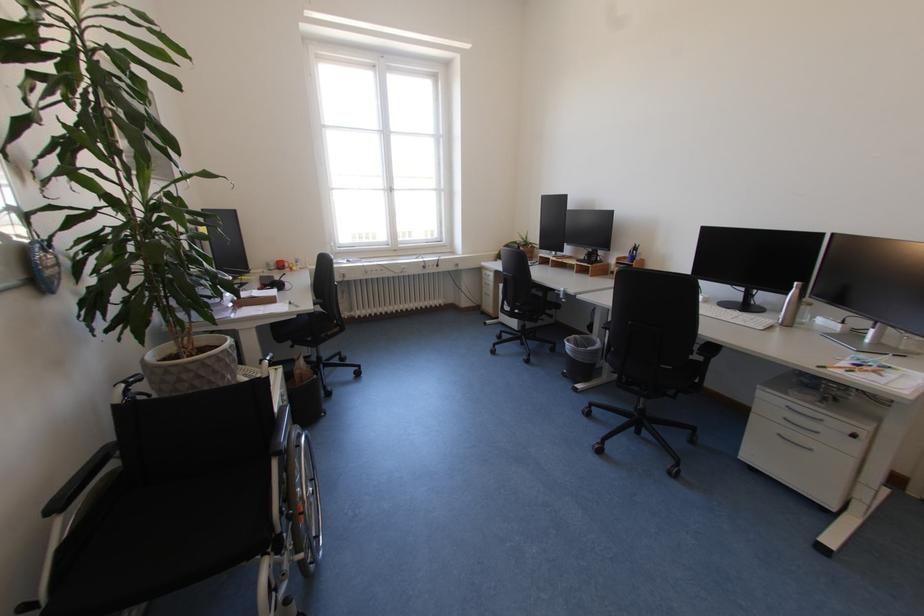
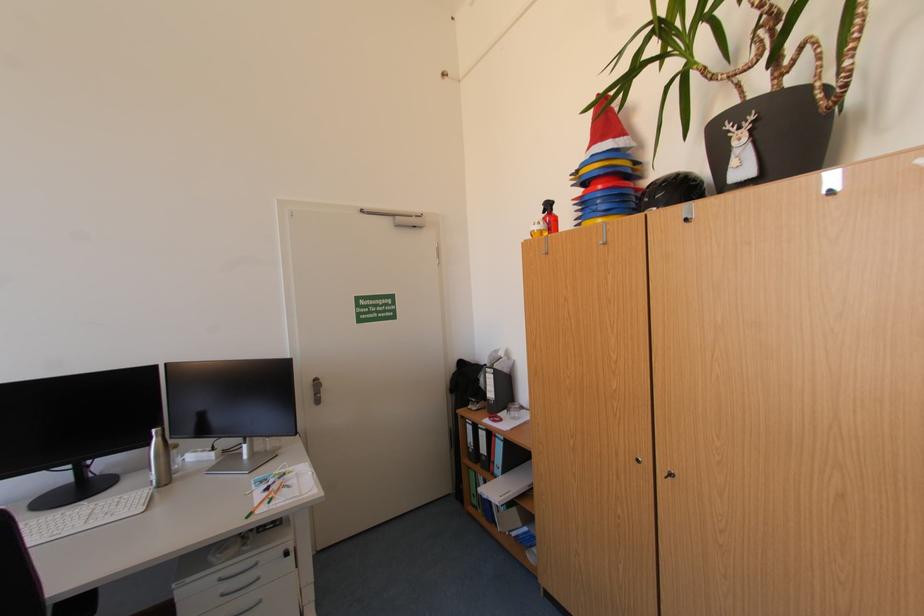
Find the pixel in the second image that matches point (831, 236) in the first image.

(164, 368)